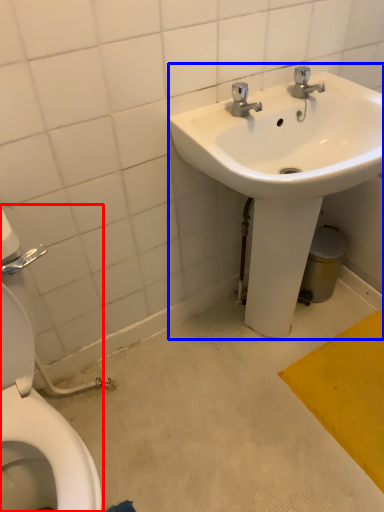
Question: Among these objects, which one is farthest to the camera, toilet (highlighted by a red box) or sink (highlighted by a blue box)?

Choices:
 (A) toilet
 (B) sink

Answer: (B)